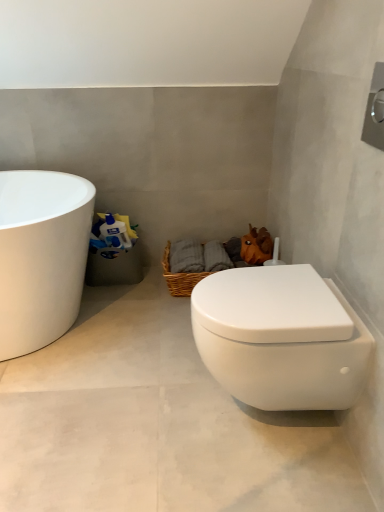
Identify the location of empty space that is ontop of white glossy toilet at lower right (from a real-world perspective). (272, 291).